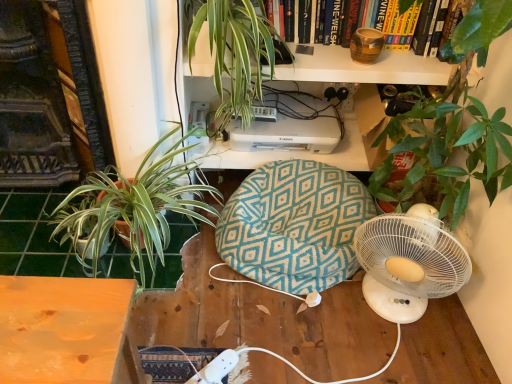
Question: From the image's perspective, is teal fabric bean bag at center above or below brown textured vase at upper center?

Choices:
 (A) below
 (B) above

Answer: (A)

Question: From a real-world perspective, is teal fabric bean bag at center physically located above or below brown textured vase at upper center?

Choices:
 (A) above
 (B) below

Answer: (B)

Question: Which of these objects is positioned farthest from the green leafy plant at left, arranged as the 2th houseplant when viewed from the top?

Choices:
 (A) teal fabric bean bag at center
 (B) brown textured vase at upper center
 (C) green leafy plant at upper center, arranged as the 2th houseplant when ordered from the bottom
 (D) white plastic printer at upper center
 (E) green tile at lower left

Answer: (B)

Question: Which object is the farthest from the teal fabric bean bag at center?

Choices:
 (A) white plastic printer at upper center
 (B) green leafy plant at upper center, which is counted as the first houseplant, starting from the top
 (C) green tile at lower left
 (D) brown textured vase at upper center
 (E) green leafy plant at left, arranged as the 2th houseplant when viewed from the top

Answer: (D)